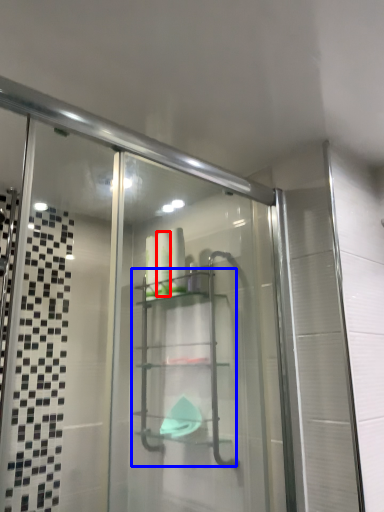
Question: Among these objects, which one is farthest to the camera, toiletry (highlighted by a red box) or glass box (highlighted by a blue box)?

Choices:
 (A) toiletry
 (B) glass box

Answer: (A)